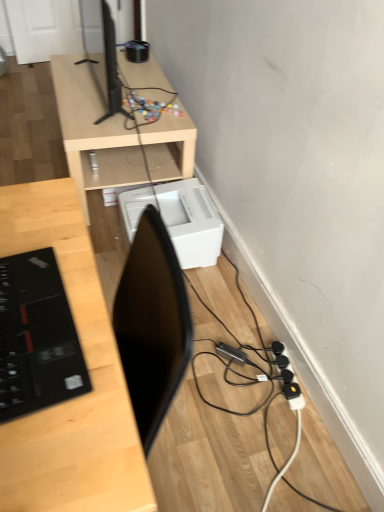
This screenshot has width=384, height=512. What are the coordinates of `free space above light wood/finished desk at upper center, which appears as the 2th desk when ordered from the bottom (from a real-world perspective)` in the screenshot? It's located at (124, 83).